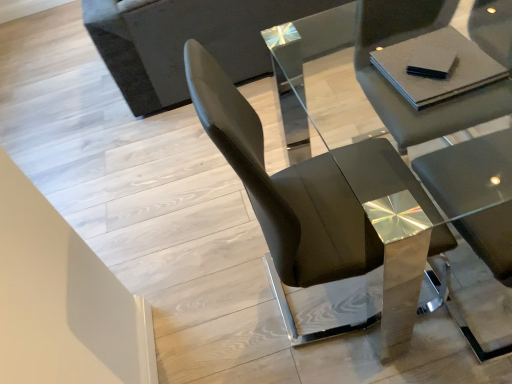
What is the approximate width of matte gray chair at center, the second chair in the left-to-right sequence?

23.16 inches.

Where is `black matte pad at upper right`? The height and width of the screenshot is (384, 512). black matte pad at upper right is located at coordinates (432, 63).

This screenshot has height=384, width=512. Describe the element at coordinates (432, 63) in the screenshot. I see `black matte pad at upper right` at that location.

What do you see at coordinates (184, 41) in the screenshot? I see `dark gray fabric couch at upper left` at bounding box center [184, 41].

What is the approximate width of glossy black chair at center, the second chair from the right?

The width of glossy black chair at center, the second chair from the right, is 22.44 inches.

The height and width of the screenshot is (384, 512). Identify the location of matte gray chair at center, the second chair in the left-to-right sequence. (398, 92).

Is glossy black chair at center, which appears as the 1th chair when viewed from the left, not within black matte pad at upper right?

Yes.

Which is nearer, (x=310, y=257) or (x=438, y=76)?

Clearly, point (x=310, y=257) is more distant from the camera than point (x=438, y=76).

Which object is thinner, glossy black chair at center, which appears as the 1th chair when viewed from the left, or black matte pad at upper right?

black matte pad at upper right is thinner.

Can you confirm if black matte pad at upper right is smaller than glossy black chair at center, which appears as the 1th chair when viewed from the left?

Indeed, black matte pad at upper right has a smaller size compared to glossy black chair at center, which appears as the 1th chair when viewed from the left.

Consider the image. From the image's perspective, is black matte pad at upper right under glossy black chair at center, the second chair from the right?

No, from the image's perspective, black matte pad at upper right is not beneath glossy black chair at center, the second chair from the right.

Does point (429, 58) come closer to viewer compared to point (347, 207)?

Yes.

Is black matte pad at upper right aimed at glossy black chair at center, which appears as the 1th chair when viewed from the left?

Yes, black matte pad at upper right faces towards glossy black chair at center, which appears as the 1th chair when viewed from the left.

Considering the relative positions of matte gray chair at center, arranged as the 1th chair when viewed from the right, and glossy black chair at center, which appears as the 1th chair when viewed from the left, in the image provided, is matte gray chair at center, arranged as the 1th chair when viewed from the right, in front of glossy black chair at center, which appears as the 1th chair when viewed from the left,?

No.

Is matte gray chair at center, the second chair in the left-to-right sequence, turned away from glossy black chair at center, which appears as the 1th chair when viewed from the left?

No, glossy black chair at center, which appears as the 1th chair when viewed from the left, is not at the back of matte gray chair at center, the second chair in the left-to-right sequence.

Does point (362, 61) appear closer or farther from the camera than point (264, 228)?

Point (362, 61) appears to be farther away from the viewer than point (264, 228).

Is matte gray chair at center, the second chair in the left-to-right sequence, at the right side of glossy black chair at center, the second chair from the right?

Yes, matte gray chair at center, the second chair in the left-to-right sequence, is to the right of glossy black chair at center, the second chair from the right.

Is black matte pad at upper right shorter than matte gray chair at center, arranged as the 1th chair when viewed from the right?

Indeed, black matte pad at upper right has a lesser height compared to matte gray chair at center, arranged as the 1th chair when viewed from the right.

Is black matte pad at upper right bigger or smaller than matte gray chair at center, arranged as the 1th chair when viewed from the right?

In the image, black matte pad at upper right appears to be smaller than matte gray chair at center, arranged as the 1th chair when viewed from the right.

Which object is thinner, black matte pad at upper right or matte gray chair at center, arranged as the 1th chair when viewed from the right?

Thinner between the two is black matte pad at upper right.

Does black matte pad at upper right turn towards matte gray chair at center, arranged as the 1th chair when viewed from the right?

Yes, black matte pad at upper right is aimed at matte gray chair at center, arranged as the 1th chair when viewed from the right.

Is glossy black chair at center, the second chair from the right, facing away from matte gray chair at center, the second chair in the left-to-right sequence?

glossy black chair at center, the second chair from the right, does not have its back to matte gray chair at center, the second chair in the left-to-right sequence.

The height and width of the screenshot is (384, 512). What are the coordinates of `chair below the matte gray chair at center, arranged as the 1th chair when viewed from the right (from the image's perspective)` in the screenshot? It's located at (322, 204).

Is glossy black chair at center, the second chair from the right, to the right of matte gray chair at center, the second chair in the left-to-right sequence, from the viewer's perspective?

Incorrect, glossy black chair at center, the second chair from the right, is not on the right side of matte gray chair at center, the second chair in the left-to-right sequence.

Is glossy black chair at center, which appears as the 1th chair when viewed from the left, far from matte gray chair at center, arranged as the 1th chair when viewed from the right?

No, glossy black chair at center, which appears as the 1th chair when viewed from the left, is in close proximity to matte gray chair at center, arranged as the 1th chair when viewed from the right.

In the scene shown: From a real-world perspective, is matte gray chair at center, arranged as the 1th chair when viewed from the right, positioned over black matte pad at upper right based on gravity?

Actually, matte gray chair at center, arranged as the 1th chair when viewed from the right, is physically below black matte pad at upper right in the real world.

Which object is more forward, matte gray chair at center, arranged as the 1th chair when viewed from the right, or black matte pad at upper right?

matte gray chair at center, arranged as the 1th chair when viewed from the right.

Is matte gray chair at center, arranged as the 1th chair when viewed from the right, looking in the opposite direction of black matte pad at upper right?

No, matte gray chair at center, arranged as the 1th chair when viewed from the right, is not facing the opposite direction of black matte pad at upper right.

Are matte gray chair at center, arranged as the 1th chair when viewed from the right, and black matte pad at upper right far apart?

No, there isn't a large distance between matte gray chair at center, arranged as the 1th chair when viewed from the right, and black matte pad at upper right.

Locate an element on the screen. couch that is behind the glossy black chair at center, the second chair from the right is located at coordinates (184, 41).

Which is more to the left, dark gray fabric couch at upper left or glossy black chair at center, the second chair from the right?

dark gray fabric couch at upper left.

From a real-world perspective, which object rests below the other?

dark gray fabric couch at upper left, from a real-world perspective.

Is point (140, 60) positioned behind point (337, 194)?

Yes.

Identify the location of the 2nd chair in front of the black matte pad at upper right, counting from the anchor's position. The width and height of the screenshot is (512, 384). (322, 204).

The width and height of the screenshot is (512, 384). In order to click on pad behind the glossy black chair at center, which appears as the 1th chair when viewed from the left in this screenshot , I will do `click(432, 63)`.

Looking at the image, which one is located closer to black matte pad at upper right, glossy black chair at center, the second chair from the right, or dark gray fabric couch at upper left?

glossy black chair at center, the second chair from the right, is positioned closer to the anchor black matte pad at upper right.

When comparing their distances from glossy black chair at center, which appears as the 1th chair when viewed from the left, does black matte pad at upper right or matte gray chair at center, the second chair in the left-to-right sequence, seem further?

The object further to glossy black chair at center, which appears as the 1th chair when viewed from the left, is black matte pad at upper right.

Looking at the image, which one is located further to black matte pad at upper right, dark gray fabric couch at upper left or glossy black chair at center, which appears as the 1th chair when viewed from the left?

dark gray fabric couch at upper left.

Considering their positions, is black matte pad at upper right positioned closer to matte gray chair at center, arranged as the 1th chair when viewed from the right, than dark gray fabric couch at upper left?

black matte pad at upper right is closer to matte gray chair at center, arranged as the 1th chair when viewed from the right.

When comparing their distances from glossy black chair at center, the second chair from the right, does matte gray chair at center, arranged as the 1th chair when viewed from the right, or dark gray fabric couch at upper left seem closer?

matte gray chair at center, arranged as the 1th chair when viewed from the right, lies closer to glossy black chair at center, the second chair from the right, than the other object.

When comparing their distances from matte gray chair at center, the second chair in the left-to-right sequence, does glossy black chair at center, which appears as the 1th chair when viewed from the left, or black matte pad at upper right seem further?

The object further to matte gray chair at center, the second chair in the left-to-right sequence, is glossy black chair at center, which appears as the 1th chair when viewed from the left.

Looking at the image, which one is located closer to matte gray chair at center, arranged as the 1th chair when viewed from the right, dark gray fabric couch at upper left or glossy black chair at center, the second chair from the right?

Based on the image, glossy black chair at center, the second chair from the right, appears to be nearer to matte gray chair at center, arranged as the 1th chair when viewed from the right.

When comparing their distances from glossy black chair at center, which appears as the 1th chair when viewed from the left, does matte gray chair at center, arranged as the 1th chair when viewed from the right, or black matte pad at upper right seem closer?

Based on the image, matte gray chair at center, arranged as the 1th chair when viewed from the right, appears to be nearer to glossy black chair at center, which appears as the 1th chair when viewed from the left.

Where is `chair between dark gray fabric couch at upper left and glossy black chair at center, the second chair from the right, in the up-down direction`? This screenshot has height=384, width=512. chair between dark gray fabric couch at upper left and glossy black chair at center, the second chair from the right, in the up-down direction is located at coordinates (398, 92).

Find the location of a particular element. The width and height of the screenshot is (512, 384). pad between dark gray fabric couch at upper left and glossy black chair at center, the second chair from the right, in the vertical direction is located at coordinates pos(432,63).

This screenshot has height=384, width=512. In order to click on pad between matte gray chair at center, arranged as the 1th chair when viewed from the right, and glossy black chair at center, the second chair from the right, in the vertical direction in this screenshot , I will do `click(432, 63)`.

Locate an element on the screen. chair that lies between dark gray fabric couch at upper left and black matte pad at upper right from top to bottom is located at coordinates point(398,92).